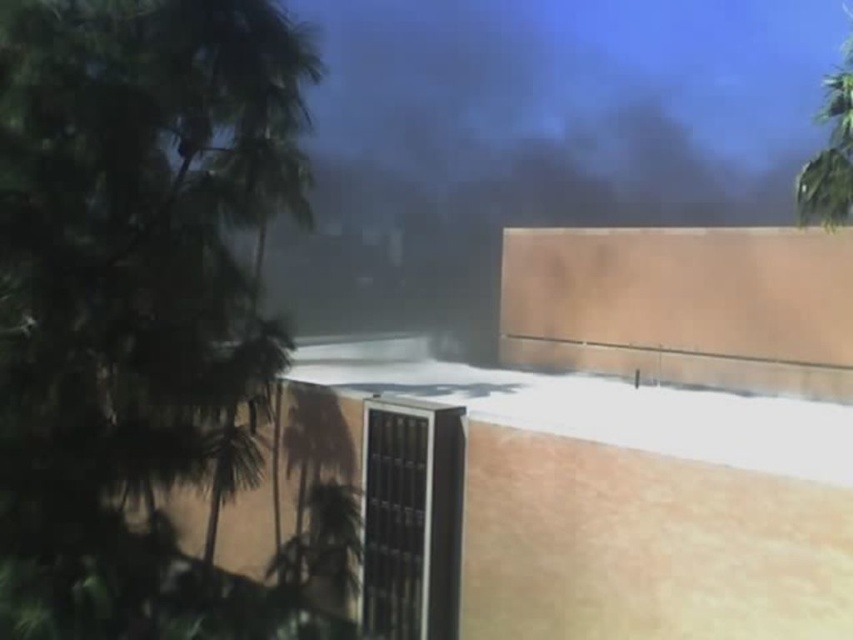
Question: Does green leafy tree at left appear over green leafy tree at upper right?

Choices:
 (A) no
 (B) yes

Answer: (A)

Question: Is green leafy tree at left further to the viewer compared to green leafy tree at upper right?

Choices:
 (A) no
 (B) yes

Answer: (A)

Question: Which point is closer to the camera?

Choices:
 (A) green leafy tree at upper right
 (B) green leafy tree at left

Answer: (B)

Question: Is green leafy tree at left positioned in front of green leafy tree at upper right?

Choices:
 (A) no
 (B) yes

Answer: (B)